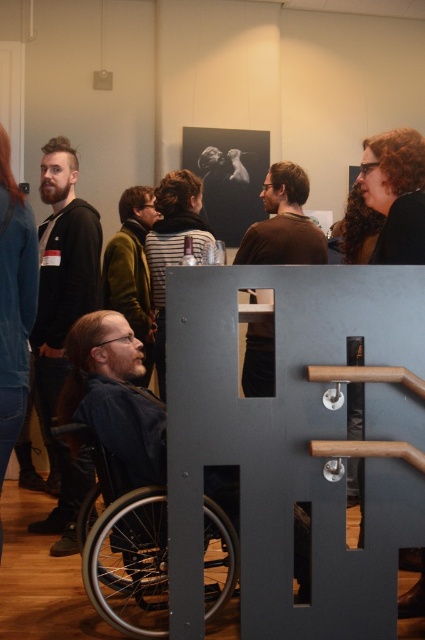
Question: Which of these objects is positioned closest to the silver metallic wheelchair at lower left?

Choices:
 (A) brown matte shirt at center
 (B) dark blue leather wheelchair at center

Answer: (B)

Question: Is silver metallic wheelchair at lower left smaller than dark blue leather wheelchair at center?

Choices:
 (A) no
 (B) yes

Answer: (B)

Question: Does dark blue leather wheelchair at center appear on the right side of dark brown hoodie at left?

Choices:
 (A) no
 (B) yes

Answer: (B)

Question: Which of the following is the farthest from the observer?

Choices:
 (A) pos(79,285)
 (B) pos(130,396)
 (C) pos(263,360)
 (D) pos(164,563)

Answer: (C)

Question: Among these objects, which one is farthest from the camera?

Choices:
 (A) brown matte shirt at center
 (B) dark brown hoodie at left

Answer: (A)

Question: Does dark blue leather wheelchair at center lie in front of dark brown hoodie at left?

Choices:
 (A) no
 (B) yes

Answer: (B)